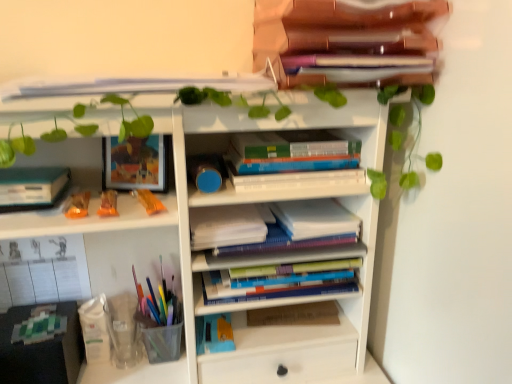
In order to click on free point above hardcover books at center, which appears as the third book when ordered from the bottom (from a real-world perspective) in this screenshot , I will do `click(292, 139)`.